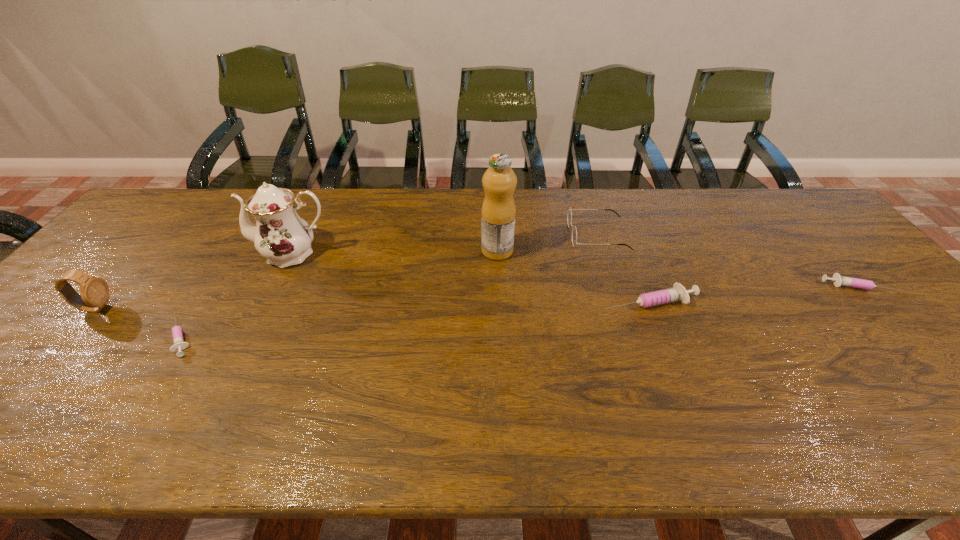
Where is `free space that is in between the fourth tallest object and the fruit juice`? Image resolution: width=960 pixels, height=540 pixels. free space that is in between the fourth tallest object and the fruit juice is located at coordinates (547, 243).

The width and height of the screenshot is (960, 540). What are the coordinates of `free area in between the watch and the sixth tallest object` in the screenshot? It's located at 476,298.

I want to click on free space between the fourth shortest object and the fourth object from left to right, so click(547, 243).

Where is `the fifth closest object to the tallest object`? The width and height of the screenshot is (960, 540). the fifth closest object to the tallest object is located at coordinates (838, 280).

Locate an element on the screen. The height and width of the screenshot is (540, 960). object that is the fifth closest to the shortest object is located at coordinates (678, 293).

Select which syringe is the closest to the second shortest syringe. Please provide its 2D coordinates. Your answer should be formatted as a tuple, i.e. [(x, y)], where the tuple contains the x and y coordinates of a point satisfying the conditions above.

[(678, 293)]

Locate which syringe ranks in proximity to the spectacles. Please provide its 2D coordinates. Your answer should be formatted as a tuple, i.e. [(x, y)], where the tuple contains the x and y coordinates of a point satisfying the conditions above.

[(678, 293)]

Identify the location of free space that satisfies the following two spatial constraints: 1. on the front label of the fourth object from left to right; 2. on the front side of the sixth shortest object. The image size is (960, 540). (497, 253).

Identify the location of free space in the image that satisfies the following two spatial constraints: 1. on the front label of the fourth object from left to right; 2. on the front side of the nearest syringe. The height and width of the screenshot is (540, 960). (501, 337).

At what (x,y) coordinates should I click in order to perform the action: click on free space that satisfies the following two spatial constraints: 1. on the front label of the fourth object from right to left; 2. on the left side of the third shortest object. Please return your answer as a coordinate pair (x, y). Looking at the image, I should click on (499, 302).